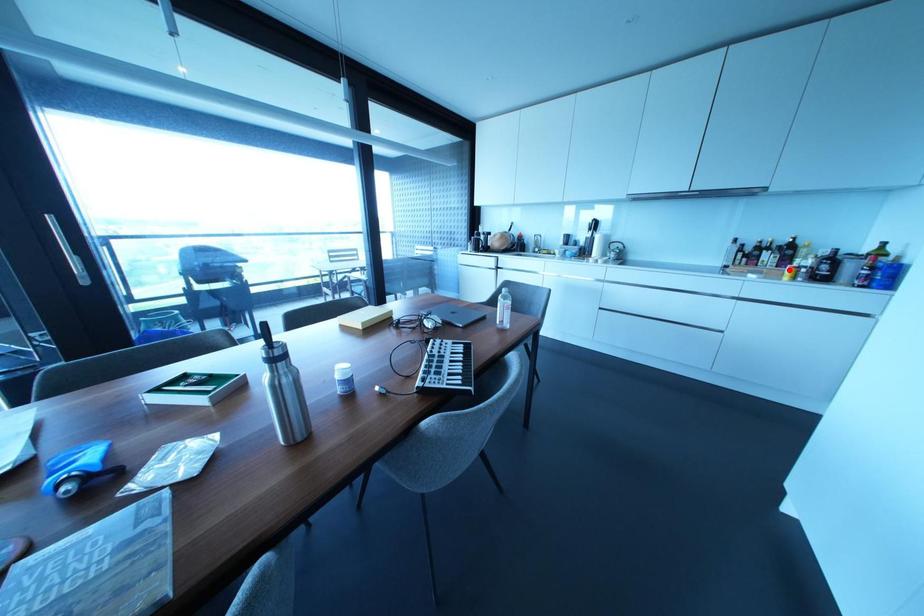
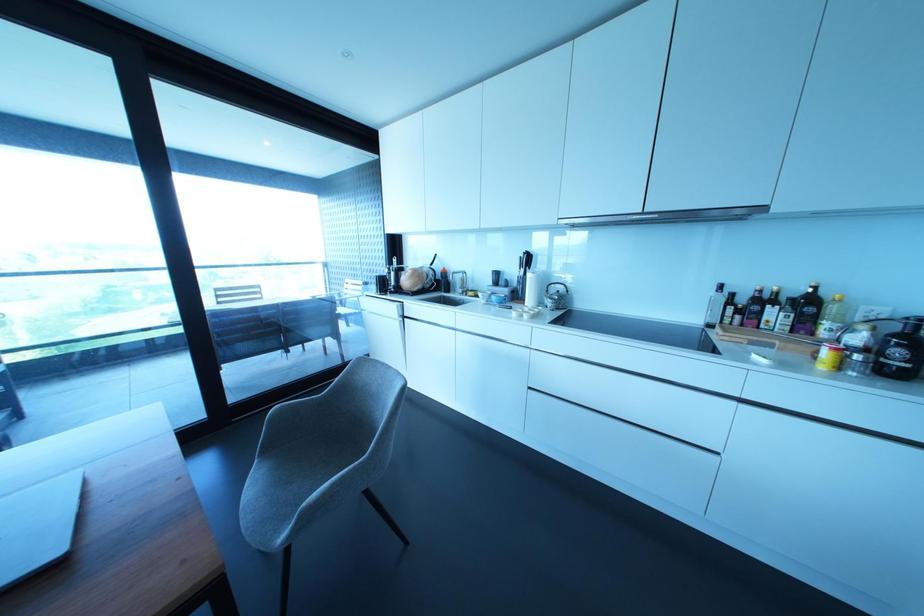
Where in the second image is the point corresponding to the highlighted location from the first image?

(825, 353)